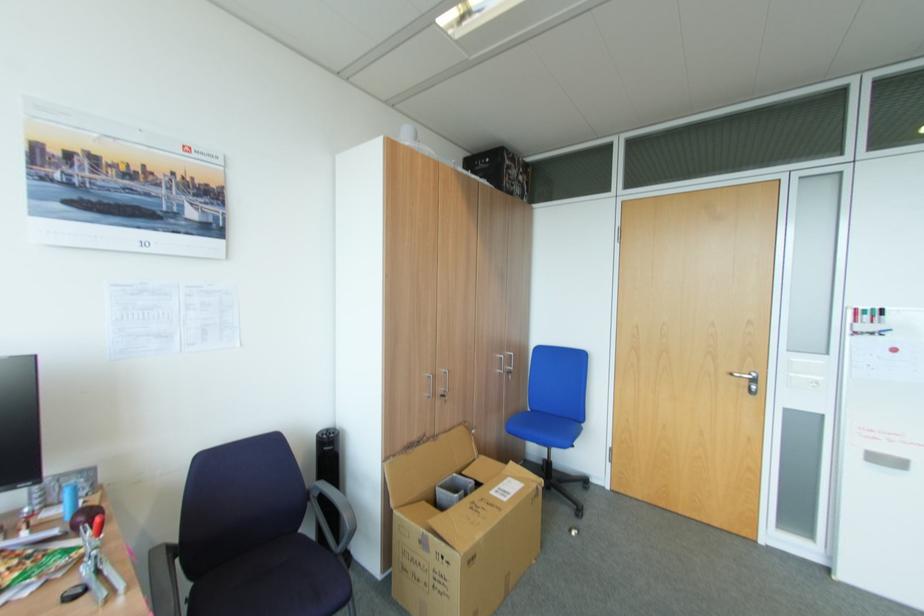
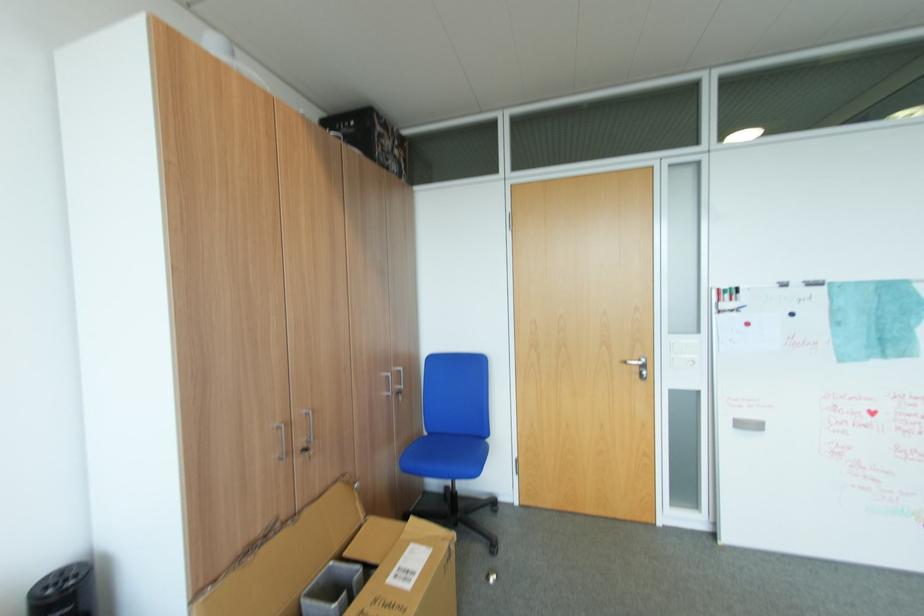
Question: In a continuous first-person perspective shot, in which direction is the camera moving?

Choices:
 (A) Left
 (B) Right
 (C) Forward
 (D) Backward

Answer: (C)